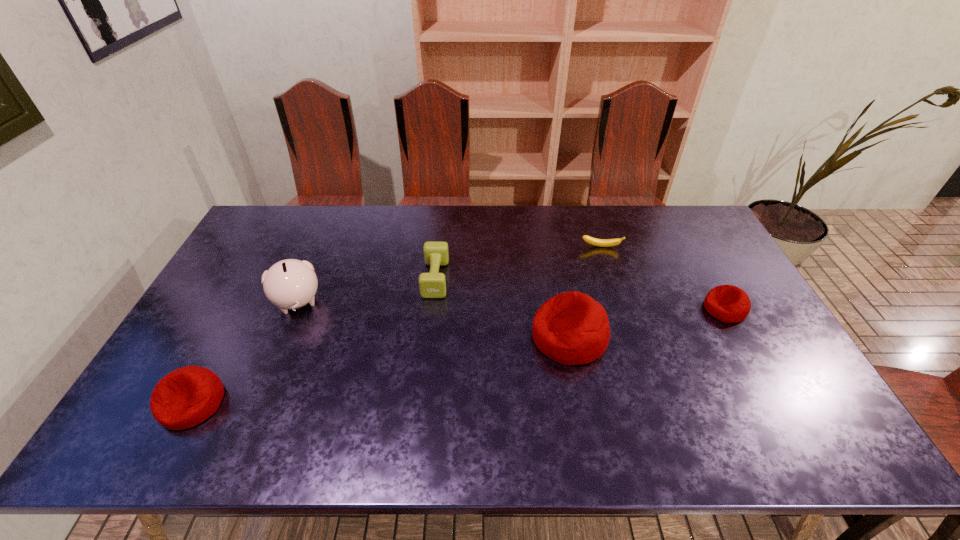
Locate an element on the screen. The height and width of the screenshot is (540, 960). empty space between the banana and the fifth object from right to left is located at coordinates (449, 275).

At what (x,y) coordinates should I click in order to perform the action: click on vacant area between the tallest beanbag and the farthest object. Please return your answer as a coordinate pair (x, y). Looking at the image, I should click on (586, 292).

Locate an element on the screen. free spot between the rightmost beanbag and the piggy bank is located at coordinates (511, 306).

Where is `free point between the leftmost beanbag and the dumbbell`? The image size is (960, 540). free point between the leftmost beanbag and the dumbbell is located at coordinates (314, 341).

Image resolution: width=960 pixels, height=540 pixels. I want to click on vacant area between the shortest object and the shortest beanbag, so click(663, 278).

Locate an element on the screen. The height and width of the screenshot is (540, 960). free area in between the rightmost beanbag and the fifth object from right to left is located at coordinates (511, 306).

The height and width of the screenshot is (540, 960). Identify the location of the closest object to the second beanbag from right to left. (433, 284).

Identify the location of the second closest object relative to the dumbbell. (288, 284).

The width and height of the screenshot is (960, 540). Find the location of `the second closest beanbag relative to the leftmost object`. the second closest beanbag relative to the leftmost object is located at coordinates (728, 303).

Identify the location of beanbag that stands as the second closest to the shortest object. (728, 303).